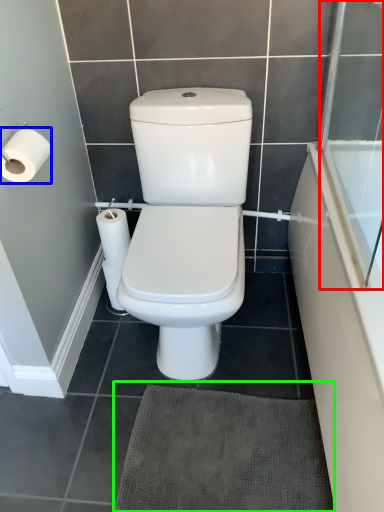
Question: Which is nearer to the screen door (highlighted by a red box)? toilet paper (highlighted by a blue box) or bath mat (highlighted by a green box).

Choices:
 (A) toilet paper
 (B) bath mat

Answer: (B)